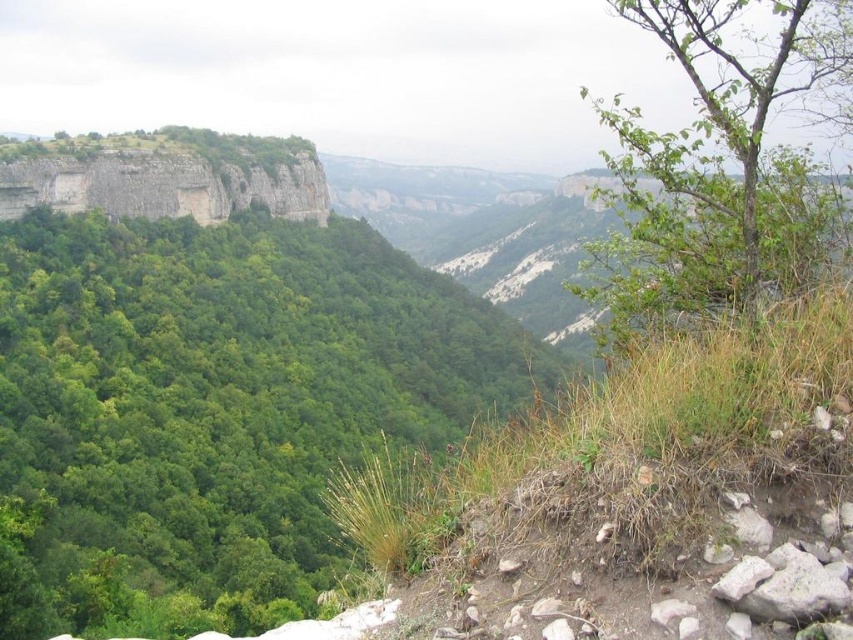
You are an environmental scientist assessing the valley. You have a drone that can capture images of trees. Which tree, the green leafy tree at center or the green leafy tree at upper right, would require a wider camera angle to capture its full width?

The green leafy tree at upper right requires a wider camera angle because its width is greater than the green leafy tree at center.